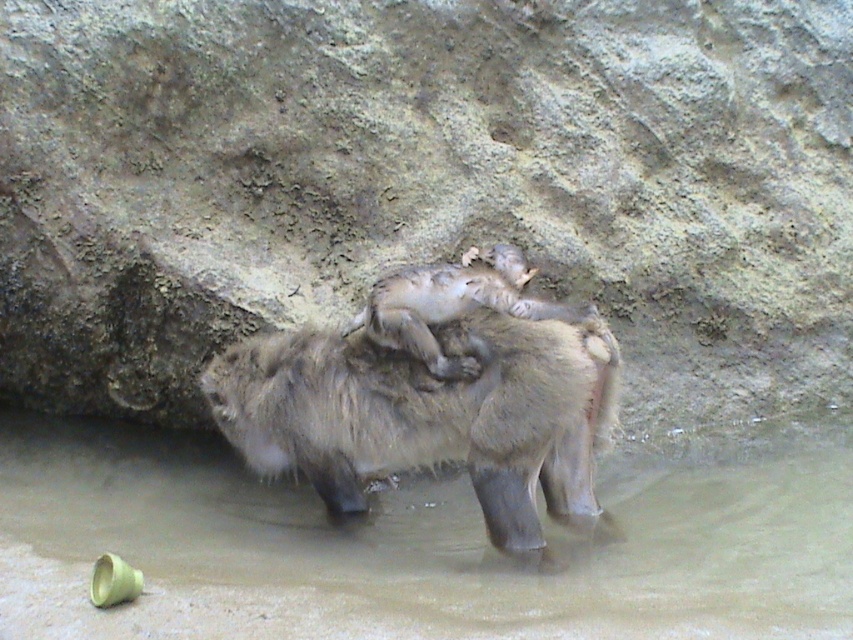
Who is positioned more to the right, brown rough rock at center or fuzzy fur monkey at center?

brown rough rock at center

Who is taller, brown rough rock at center or fuzzy fur monkey at center?

brown rough rock at center is taller.

The width and height of the screenshot is (853, 640). I want to click on brown rough rock at center, so click(425, 182).

Find the location of `muddy water at lower center`. muddy water at lower center is located at coordinates (419, 545).

Image resolution: width=853 pixels, height=640 pixels. In order to click on muddy water at lower center in this screenshot , I will do `click(419, 545)`.

Identify the location of muddy water at lower center. (419, 545).

Which is in front, point (198, 1) or point (399, 634)?

Point (399, 634) is in front.

The height and width of the screenshot is (640, 853). Find the location of `brown rough rock at center`. brown rough rock at center is located at coordinates (425, 182).

Is point (577, 211) farther from viewer compared to point (143, 468)?

That is True.

I want to click on brown rough rock at center, so click(425, 182).